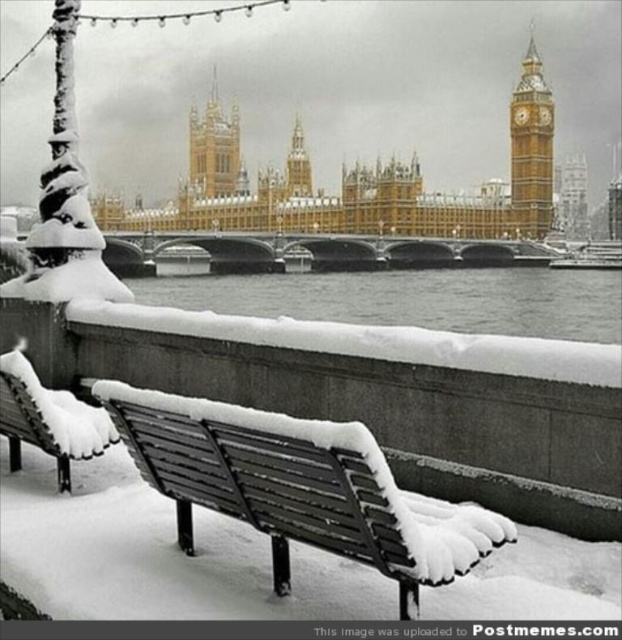
Is metallic park bench at lower left positioned in front of gold/golden stone tower at center?

Yes, it is in front of gold/golden stone tower at center.

Is metallic park bench at lower left positioned behind gold/golden stone tower at center?

No.

Where is `metallic park bench at lower left`? The height and width of the screenshot is (640, 622). metallic park bench at lower left is located at coordinates (299, 486).

Who is taller, metallic park bench at lower left or golden stone clock tower at upper right?

golden stone clock tower at upper right is taller.

Is metallic park bench at lower left to the left of golden stone clock tower at upper right from the viewer's perspective?

Correct, you'll find metallic park bench at lower left to the left of golden stone clock tower at upper right.

Is point (177, 413) positioned before point (521, 116)?

Yes, it is in front of point (521, 116).

Where is `metallic park bench at lower left`? metallic park bench at lower left is located at coordinates (299, 486).

Between golden stone clock tower at upper right and gold/golden stone tower at center, which one appears on the right side from the viewer's perspective?

golden stone clock tower at upper right

Between point (526, 129) and point (193, 132), which one is positioned behind?

Point (193, 132)

Find the location of a particular element. golden stone clock tower at upper right is located at coordinates (531, 148).

This screenshot has width=622, height=640. I want to click on golden stone clock tower at upper right, so click(531, 148).